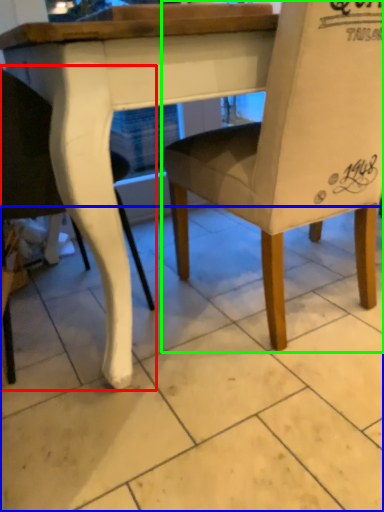
Question: Considering the real-world distances, which object is closest to chair (highlighted by a red box)? tile (highlighted by a blue box) or chair (highlighted by a green box).

Choices:
 (A) tile
 (B) chair

Answer: (B)